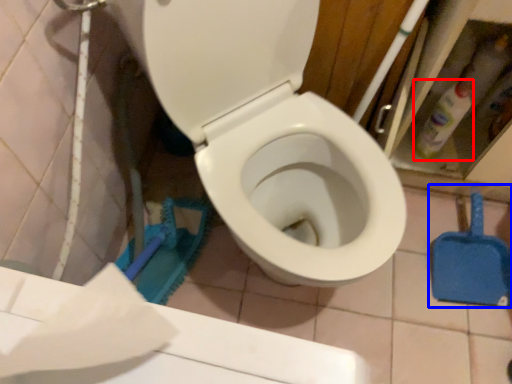
Question: Which of the following is the closest to the observer, cleaning product (highlighted by a red box) or shovel (highlighted by a blue box)?

Choices:
 (A) cleaning product
 (B) shovel

Answer: (A)